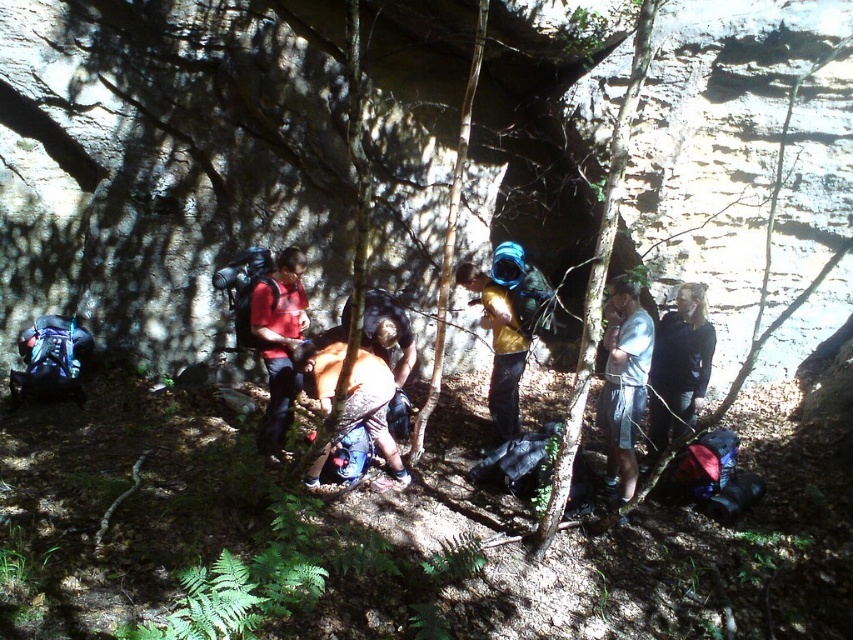
Question: Considering the relative positions of light blue denim shorts at center and brown fabric backpack at center in the image provided, where is light blue denim shorts at center located with respect to brown fabric backpack at center?

Choices:
 (A) right
 (B) left

Answer: (A)

Question: Which object is the closest to the brown fabric backpack at center?

Choices:
 (A) matte red shirt at center
 (B) yellow matte shirt at center

Answer: (A)

Question: Based on their relative distances, which object is nearer to the black matte jacket at right?

Choices:
 (A) brown fabric backpack at center
 (B) light blue denim shorts at center
 (C) yellow matte shirt at center
 (D) matte red shirt at center

Answer: (B)

Question: Is brown fabric backpack at center further to the viewer compared to yellow matte shirt at center?

Choices:
 (A) yes
 (B) no

Answer: (B)

Question: Which point is farther to the camera?

Choices:
 (A) (688, 292)
 (B) (361, 410)
 (C) (293, 275)
 (D) (495, 355)

Answer: (D)

Question: Can you confirm if matte red shirt at center is wider than yellow matte shirt at center?

Choices:
 (A) no
 (B) yes

Answer: (A)